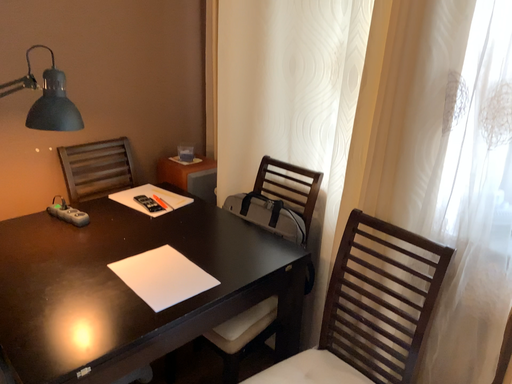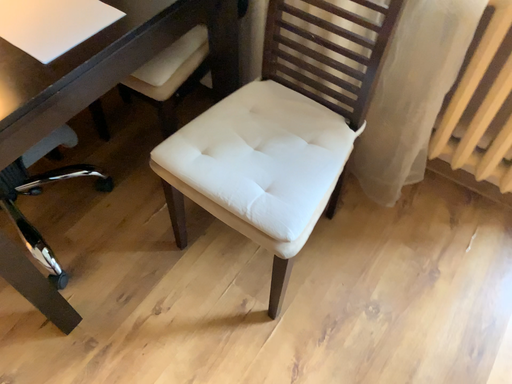
Question: How did the camera likely rotate when shooting the video?

Choices:
 (A) rotated upward
 (B) rotated downward

Answer: (B)